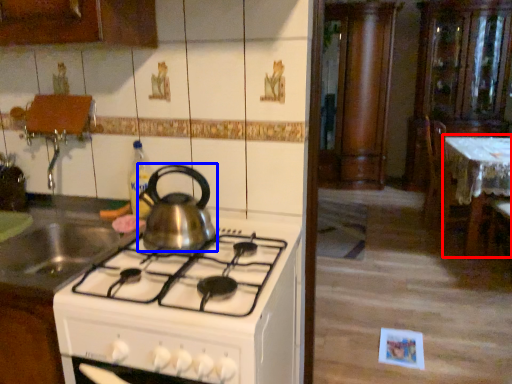
Question: Among these objects, which one is farthest to the camera, table (highlighted by a red box) or kitchen appliance (highlighted by a blue box)?

Choices:
 (A) table
 (B) kitchen appliance

Answer: (A)